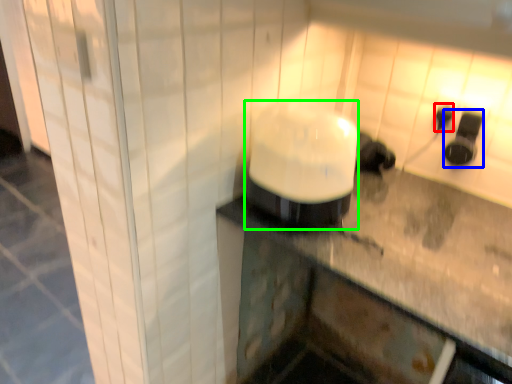
Question: Estimate the real-world distances between objects in this image. Which object is farther from electric outlet (highlighted by a red box), appliance (highlighted by a blue box) or appliance (highlighted by a green box)?

Choices:
 (A) appliance
 (B) appliance

Answer: (B)